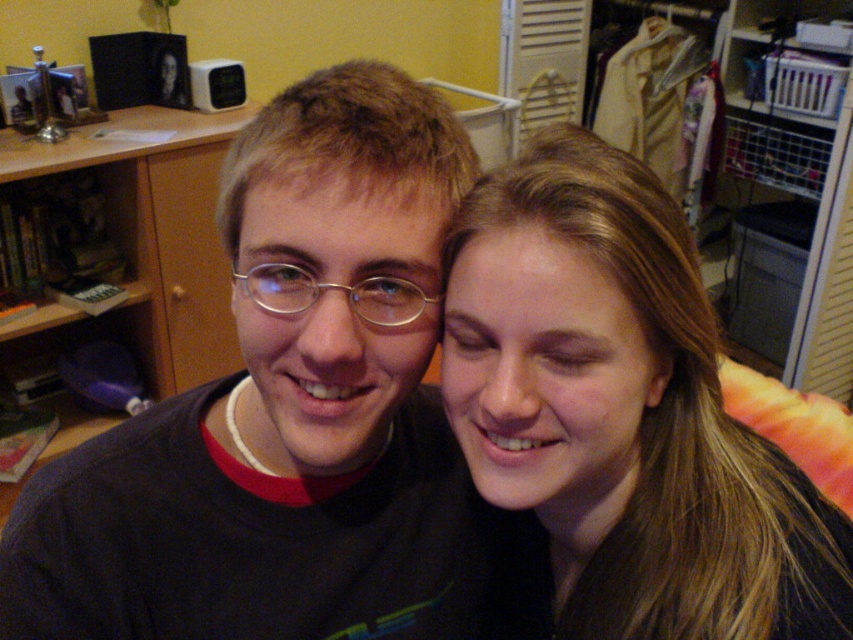
Can you confirm if smooth brown hair at right is thinner than wooden bookshelf at left?

Correct, smooth brown hair at right's width is less than wooden bookshelf at left's.

What do you see at coordinates (622, 413) in the screenshot?
I see `smooth brown hair at right` at bounding box center [622, 413].

Locate an element on the screen. smooth brown hair at right is located at coordinates (622, 413).

The width and height of the screenshot is (853, 640). In order to click on smooth brown hair at right in this screenshot , I will do `click(622, 413)`.